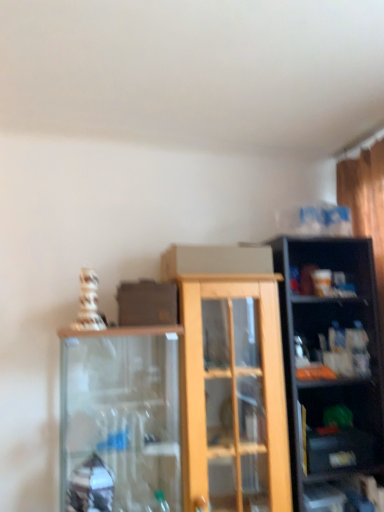
Question: Considering the relative sizes of matte black shelf at lower right, the 2th shelf viewed from the top, and clear plastic bottles at right, placed as the 1th shelf when sorted from top to bottom, in the image provided, is matte black shelf at lower right, the 2th shelf viewed from the top, smaller than clear plastic bottles at right, placed as the 1th shelf when sorted from top to bottom,?

Choices:
 (A) yes
 (B) no

Answer: (A)

Question: From a real-world perspective, is matte black shelf at lower right, the 2th shelf viewed from the top, located higher than clear plastic bottles at right, which is counted as the second shelf, starting from the bottom?

Choices:
 (A) no
 (B) yes

Answer: (A)

Question: Is matte black shelf at lower right, the 2th shelf viewed from the top, shorter than clear plastic bottles at right, which is counted as the second shelf, starting from the bottom?

Choices:
 (A) no
 (B) yes

Answer: (B)

Question: Could you tell me if matte black shelf at lower right, which is the 1th shelf in bottom-to-top order, is facing clear plastic bottles at right, which is counted as the second shelf, starting from the bottom?

Choices:
 (A) yes
 (B) no

Answer: (B)

Question: Is matte black shelf at lower right, which is the 1th shelf in bottom-to-top order, to the left of clear plastic bottles at right, which is counted as the second shelf, starting from the bottom, from the viewer's perspective?

Choices:
 (A) yes
 (B) no

Answer: (A)

Question: Is matte black shelf at lower right, which is the 1th shelf in bottom-to-top order, turned away from clear plastic bottles at right, placed as the 1th shelf when sorted from top to bottom?

Choices:
 (A) no
 (B) yes

Answer: (A)

Question: Is clear plastic bottles at right, which is counted as the second shelf, starting from the bottom, oriented away from matte black shelf at lower right, which is the 1th shelf in bottom-to-top order?

Choices:
 (A) no
 (B) yes

Answer: (A)

Question: Can you confirm if clear plastic bottles at right, placed as the 1th shelf when sorted from top to bottom, is wider than matte black shelf at lower right, which is the 1th shelf in bottom-to-top order?

Choices:
 (A) no
 (B) yes

Answer: (B)

Question: Does clear plastic bottles at right, placed as the 1th shelf when sorted from top to bottom, have a lesser width compared to matte black shelf at lower right, which is the 1th shelf in bottom-to-top order?

Choices:
 (A) yes
 (B) no

Answer: (B)

Question: From the image's perspective, is clear plastic bottles at right, placed as the 1th shelf when sorted from top to bottom, over matte black shelf at lower right, the 2th shelf viewed from the top?

Choices:
 (A) no
 (B) yes

Answer: (B)

Question: Can you confirm if clear plastic bottles at right, placed as the 1th shelf when sorted from top to bottom, is taller than matte black shelf at lower right, the 2th shelf viewed from the top?

Choices:
 (A) no
 (B) yes

Answer: (B)

Question: Is the depth of clear plastic bottles at right, which is counted as the second shelf, starting from the bottom, greater than that of matte black shelf at lower right, which is the 1th shelf in bottom-to-top order?

Choices:
 (A) no
 (B) yes

Answer: (B)

Question: Looking at their shapes, would you say matte black shelf at lower right, the 2th shelf viewed from the top, is wider or thinner than clear plastic bottles at right, placed as the 1th shelf when sorted from top to bottom?

Choices:
 (A) thin
 (B) wide

Answer: (A)